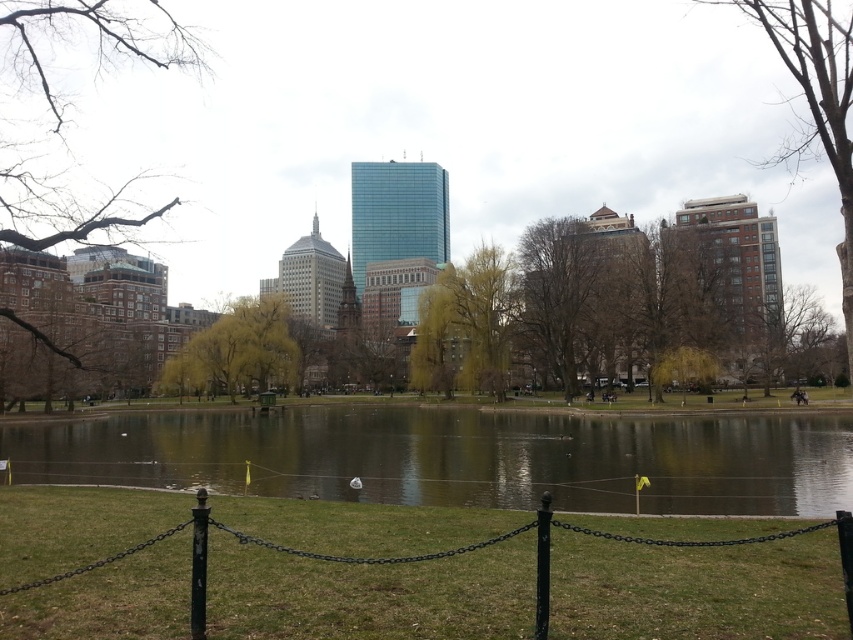
Question: Is brown textured building at right above yellow-green leaves at center?

Choices:
 (A) yes
 (B) no

Answer: (A)

Question: Is brown textured tree at center closer to camera compared to yellow-green leaves at center?

Choices:
 (A) no
 (B) yes

Answer: (B)

Question: Which point appears farthest from the camera in this image?

Choices:
 (A) (830, 96)
 (B) (386, 372)
 (C) (26, 179)
 (D) (9, 452)

Answer: (B)

Question: Which of the following is the farthest from the observer?

Choices:
 (A) green leafy tree at center
 (B) yellow-green leaves at center

Answer: (A)

Question: Considering the relative positions of green reflective water at center and yellow-green leaves at center in the image provided, where is green reflective water at center located with respect to yellow-green leaves at center?

Choices:
 (A) above
 (B) below

Answer: (B)

Question: Based on their relative distances, which object is farther from the green reflective water at center?

Choices:
 (A) brown textured building at right
 (B) yellow-green leaves at center
 (C) brown leafy tree at left
 (D) brown textured tree at center

Answer: (A)